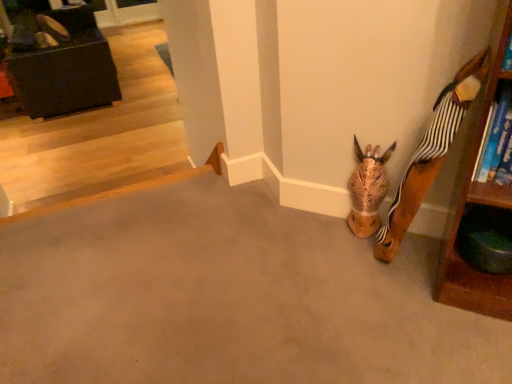
Question: Is brown matte concrete at lower right closer to the viewer compared to brown textured animal head at lower right?

Choices:
 (A) no
 (B) yes

Answer: (B)

Question: Can you confirm if brown matte concrete at lower right is bigger than brown textured animal head at lower right?

Choices:
 (A) yes
 (B) no

Answer: (A)

Question: Are brown matte concrete at lower right and brown textured animal head at lower right far apart?

Choices:
 (A) no
 (B) yes

Answer: (A)

Question: Considering the relative sizes of brown matte concrete at lower right and brown textured animal head at lower right in the image provided, is brown matte concrete at lower right wider than brown textured animal head at lower right?

Choices:
 (A) no
 (B) yes

Answer: (B)

Question: From a real-world perspective, is brown matte concrete at lower right below brown textured animal head at lower right?

Choices:
 (A) yes
 (B) no

Answer: (A)

Question: In terms of size, does matte brown shoe at upper left appear bigger or smaller than brown textured animal head at lower right?

Choices:
 (A) small
 (B) big

Answer: (B)

Question: Is point (42, 21) closer or farther from the camera than point (364, 213)?

Choices:
 (A) farther
 (B) closer

Answer: (A)

Question: From a real-world perspective, is matte brown shoe at upper left above or below brown textured animal head at lower right?

Choices:
 (A) above
 (B) below

Answer: (B)

Question: Considering the positions of matte brown shoe at upper left and brown textured animal head at lower right in the image, is matte brown shoe at upper left taller or shorter than brown textured animal head at lower right?

Choices:
 (A) tall
 (B) short

Answer: (B)

Question: Is matte black ottoman at upper left bigger or smaller than matte brown shoe at upper left?

Choices:
 (A) big
 (B) small

Answer: (A)

Question: In terms of height, does matte black ottoman at upper left look taller or shorter compared to matte brown shoe at upper left?

Choices:
 (A) tall
 (B) short

Answer: (A)

Question: Based on their positions, is matte black ottoman at upper left located to the left or right of matte brown shoe at upper left?

Choices:
 (A) left
 (B) right

Answer: (B)

Question: From the image's perspective, is matte black ottoman at upper left above or below matte brown shoe at upper left?

Choices:
 (A) below
 (B) above

Answer: (A)

Question: In terms of height, does matte brown shoe at upper left look taller or shorter compared to matte black ottoman at upper left?

Choices:
 (A) tall
 (B) short

Answer: (B)

Question: Considering the positions of point (51, 21) and point (57, 49), is point (51, 21) closer or farther from the camera than point (57, 49)?

Choices:
 (A) farther
 (B) closer

Answer: (A)